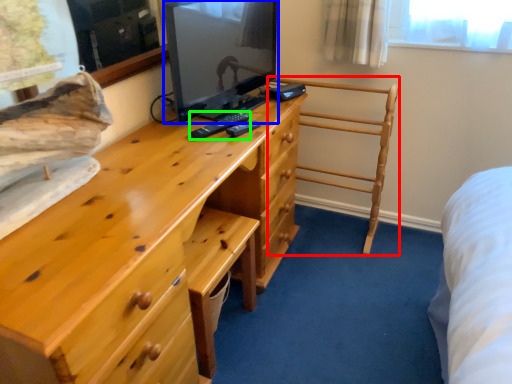
Question: Which is nearer to the furniture (highlighted by a red box)? television (highlighted by a blue box) or remote (highlighted by a green box).

Choices:
 (A) television
 (B) remote

Answer: (A)